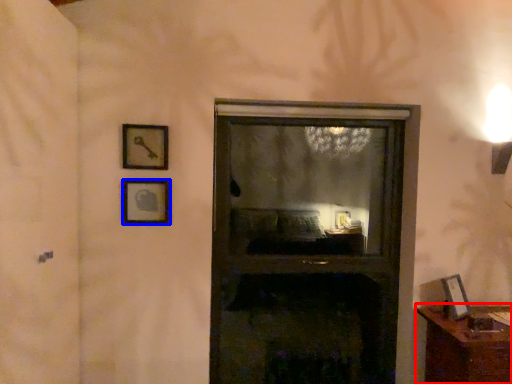
Question: Which of the following is the closest to the observer, furniture (highlighted by a red box) or picture frame (highlighted by a blue box)?

Choices:
 (A) furniture
 (B) picture frame

Answer: (A)